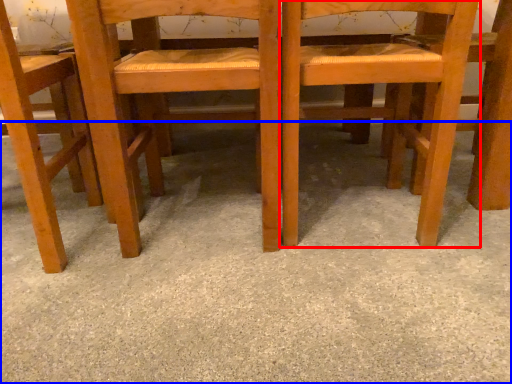
Question: Which point is closer to the camera, chair (highlighted by a red box) or concrete (highlighted by a blue box)?

Choices:
 (A) chair
 (B) concrete

Answer: (B)